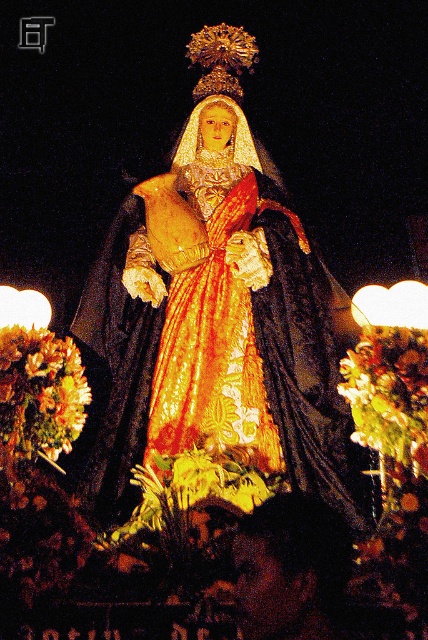
You are a photographer standing at the base of a large statue. You want to take a photo of the gold sequined dress at center. Given that your camera has a maximum focus range of 100 meters, will you be able to capture the dress clearly?

The gold sequined dress at center is 96.86 meters away from the camera. Since the camera can focus up to 100 meters, it is within the maximum range, so yes, the dress can be captured clearly.

You are an art conservator examining the statue. You need to clean both the gold sequined dress at center and the shiny dark hair at lower center. Which object should you start with if you want to clean the one closer to you first?

You should start with the gold sequined dress at center because it is closer to you than the shiny dark hair at lower center.

You are an art conservator examining the statue. You notice two elements on the statue, the shiny dark hair at lower center and the golden textured wreath at lower left. Which of these elements is positioned lower on the statue?

The shiny dark hair at lower center is positioned lower on the statue than the golden textured wreath at lower left according to the description.